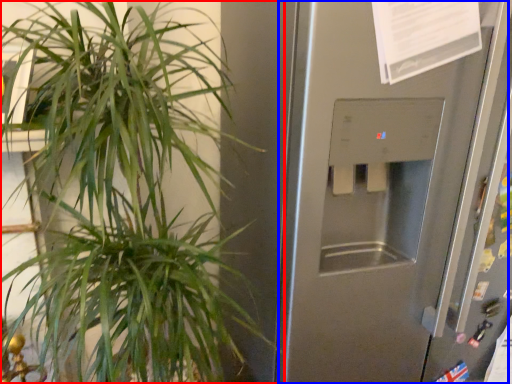
Question: Which point is further to the camera, houseplant (highlighted by a red box) or screen door (highlighted by a blue box)?

Choices:
 (A) houseplant
 (B) screen door

Answer: (B)